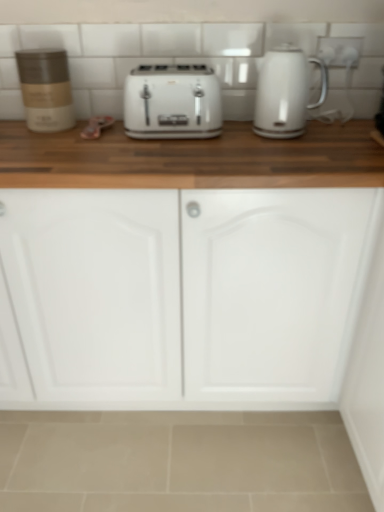
At what (x,y) coordinates should I click in order to perform the action: click on vacant space situated on the left part of matte brown container at left. Please return your answer as a coordinate pair (x, y). Looking at the image, I should click on (11, 127).